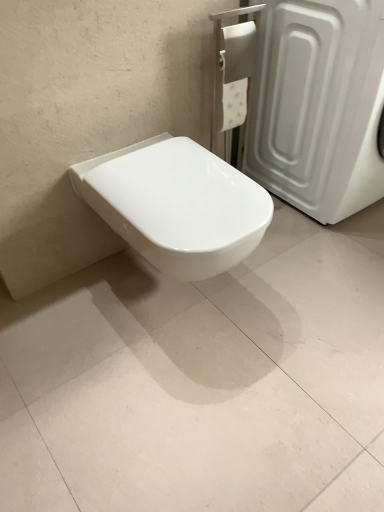
Question: Is white glossy toilet at center shorter than white glossy toilet at center?

Choices:
 (A) yes
 (B) no

Answer: (B)

Question: From the image's perspective, is white glossy toilet at center below white glossy toilet at center?

Choices:
 (A) no
 (B) yes

Answer: (A)

Question: From a real-world perspective, is white glossy toilet at center on white glossy toilet at center?

Choices:
 (A) no
 (B) yes

Answer: (B)

Question: Is white glossy toilet at center at the back of white glossy toilet at center?

Choices:
 (A) yes
 (B) no

Answer: (B)

Question: From the image's perspective, would you say white glossy toilet at center is positioned over white glossy toilet at center?

Choices:
 (A) yes
 (B) no

Answer: (A)

Question: In terms of width, does white glossy toilet at center look wider or thinner when compared to white plastic screen door at upper right?

Choices:
 (A) thin
 (B) wide

Answer: (A)

Question: Would you say white glossy toilet at center is to the left or to the right of white plastic screen door at upper right in the picture?

Choices:
 (A) right
 (B) left

Answer: (B)

Question: Which is correct: white glossy toilet at center is inside white plastic screen door at upper right, or outside of it?

Choices:
 (A) inside
 (B) outside

Answer: (B)

Question: Looking at the image, does white glossy toilet at center seem bigger or smaller compared to white plastic screen door at upper right?

Choices:
 (A) big
 (B) small

Answer: (B)

Question: In terms of size, does white plastic screen door at upper right appear bigger or smaller than white glossy toilet at center?

Choices:
 (A) big
 (B) small

Answer: (A)

Question: Considering their positions, is white plastic screen door at upper right located in front of or behind white glossy toilet at center?

Choices:
 (A) behind
 (B) front

Answer: (A)

Question: From a real-world perspective, is white plastic screen door at upper right physically located above or below white glossy toilet at center?

Choices:
 (A) below
 (B) above

Answer: (B)

Question: Which is correct: white plastic screen door at upper right is inside white glossy toilet at center, or outside of it?

Choices:
 (A) outside
 (B) inside

Answer: (A)

Question: Is point (175, 368) closer or farther from the camera than point (168, 209)?

Choices:
 (A) closer
 (B) farther

Answer: (B)

Question: Which is correct: white glossy toilet at center is inside white glossy toilet at center, or outside of it?

Choices:
 (A) outside
 (B) inside

Answer: (A)